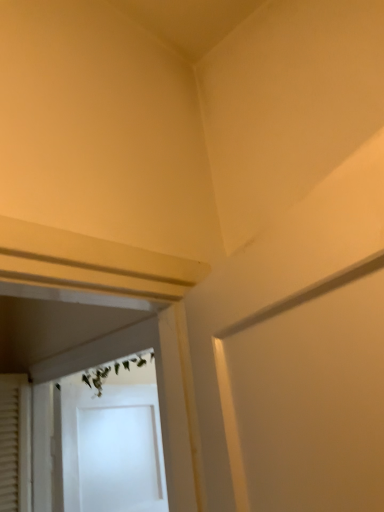
What do you see at coordinates (100, 441) in the screenshot?
I see `white glossy screen door at center` at bounding box center [100, 441].

What is the approximate height of white glossy screen door at center?

white glossy screen door at center is 26.40 inches tall.

Where is `white glossy screen door at center`? Image resolution: width=384 pixels, height=512 pixels. white glossy screen door at center is located at coordinates (100, 441).

Identify the location of white glossy screen door at center. (100, 441).